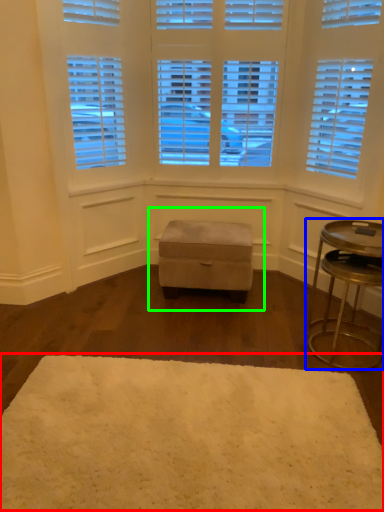
Question: Estimate the real-world distances between objects in this image. Which object is farther from mat (highlighted by a red box), table (highlighted by a blue box) or music stool (highlighted by a green box)?

Choices:
 (A) table
 (B) music stool

Answer: (B)